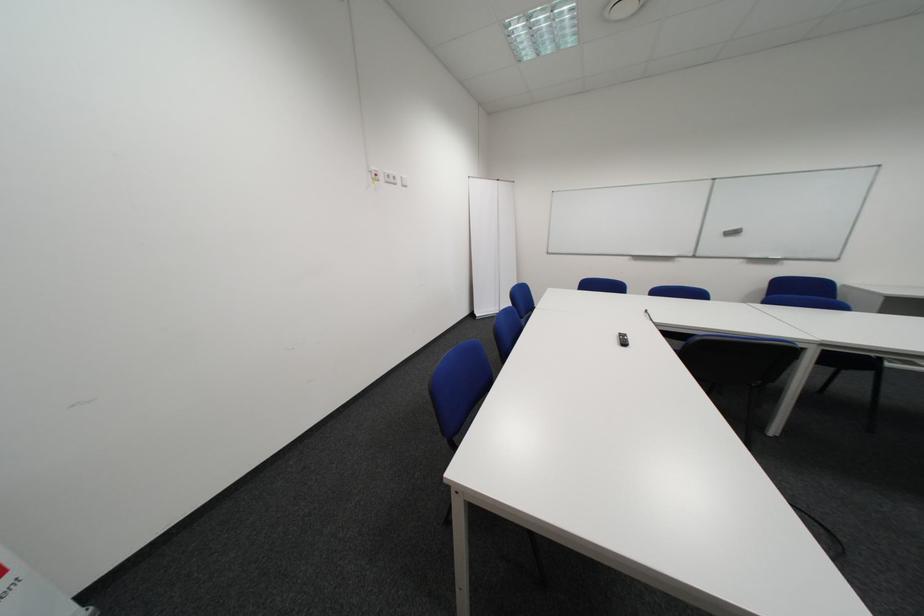
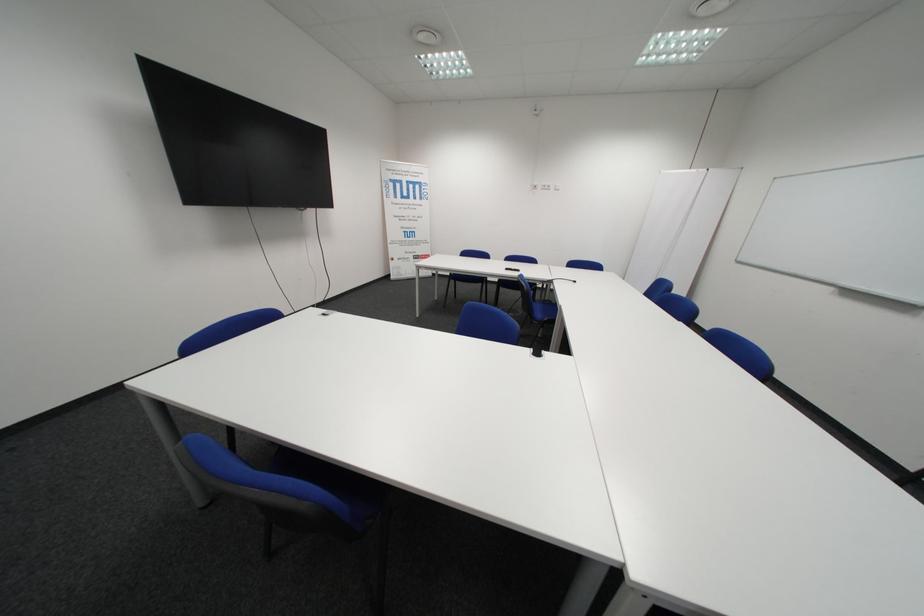
In the second image, find the point that corresponds to point 398,180 in the first image.

(554, 188)